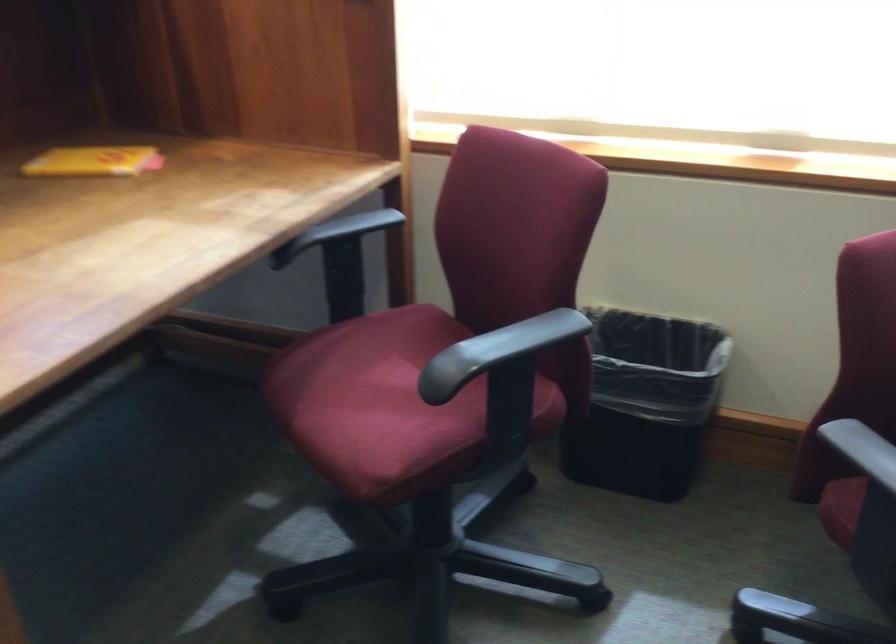
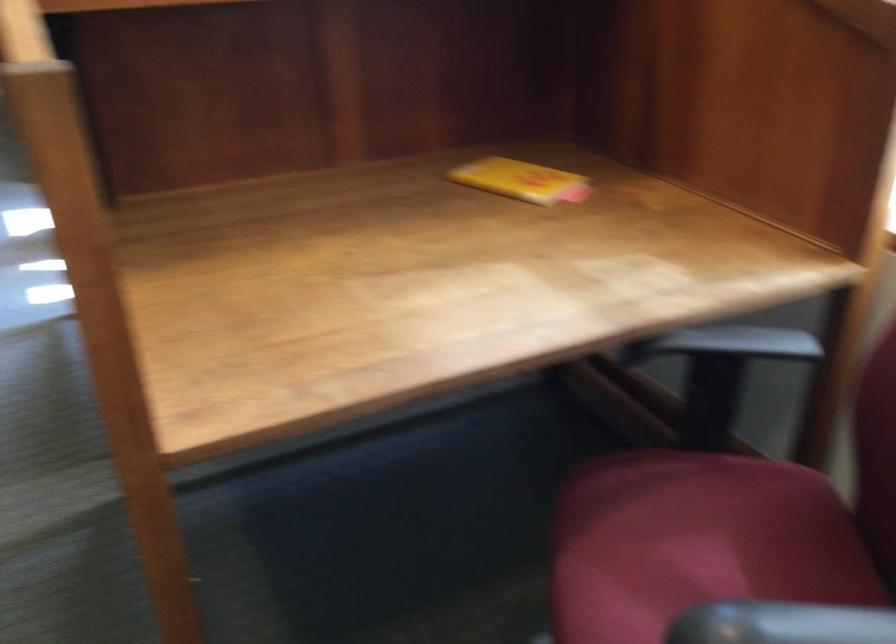
Where in the second image is the point corresponding to the point at 389,377 from the first image?

(694, 554)